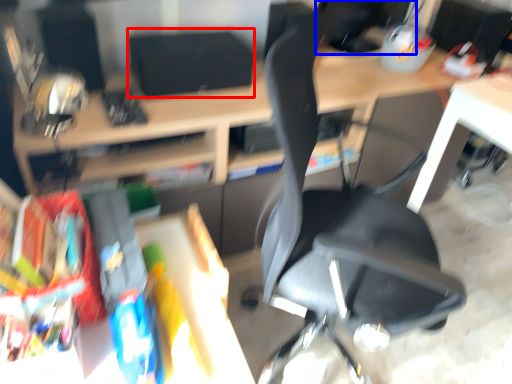
Question: Which object is closer to the camera taking this photo, computer monitor (highlighted by a red box) or computer monitor (highlighted by a blue box)?

Choices:
 (A) computer monitor
 (B) computer monitor

Answer: (A)